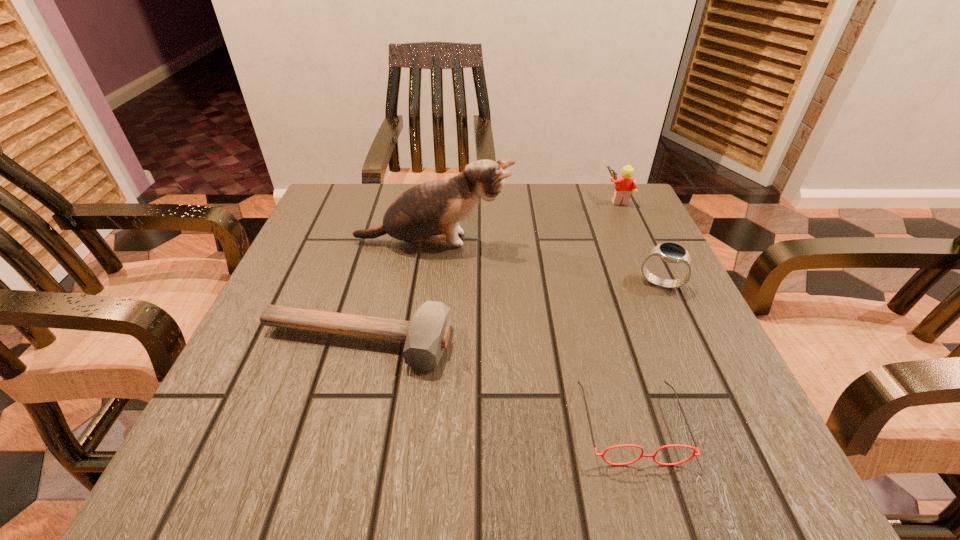
I want to click on vacant space at the far left corner of the desktop, so click(352, 208).

Locate an element on the screen. free space at the near left corner of the desktop is located at coordinates (268, 478).

You are a GUI agent. You are given a task and a screenshot of the screen. Output one action in this format:
    pyautogui.click(x=<x>, y=<y>)
    Task: Click on the free space between the tallest object and the farthest object
    This screenshot has height=540, width=960.
    Given the screenshot: What is the action you would take?
    pyautogui.click(x=525, y=220)

Identify the location of free space between the third shortest object and the farthest object. The height and width of the screenshot is (540, 960). (639, 241).

You are a GUI agent. You are given a task and a screenshot of the screen. Output one action in this format:
    pyautogui.click(x=<x>, y=<y>)
    Task: Click on the free space between the spectacles and the third nearest object
    Image resolution: width=960 pixels, height=540 pixels.
    Given the screenshot: What is the action you would take?
    pyautogui.click(x=646, y=353)

Image resolution: width=960 pixels, height=540 pixels. In order to click on vacant area that lies between the third farthest object and the tallest object in this screenshot , I will do `click(547, 262)`.

Image resolution: width=960 pixels, height=540 pixels. Find the location of `empty space between the mallet and the farthest object`. empty space between the mallet and the farthest object is located at coordinates (487, 271).

Find the location of a particular element. The width and height of the screenshot is (960, 540). vacant area that lies between the fourth farthest object and the cat is located at coordinates (395, 292).

This screenshot has width=960, height=540. I want to click on free spot between the fourth farthest object and the third object from left to right, so click(493, 383).

Identify the location of free space that is in between the watch and the tallest object. The image size is (960, 540). (547, 262).